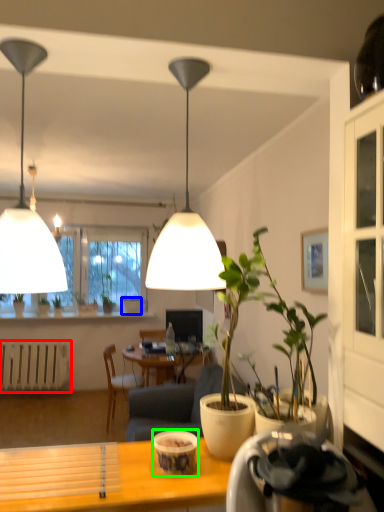
Question: Which is nearer to the radiator (highlighted by a red box)? flowerpot (highlighted by a blue box) or coffee cup (highlighted by a green box).

Choices:
 (A) flowerpot
 (B) coffee cup

Answer: (A)